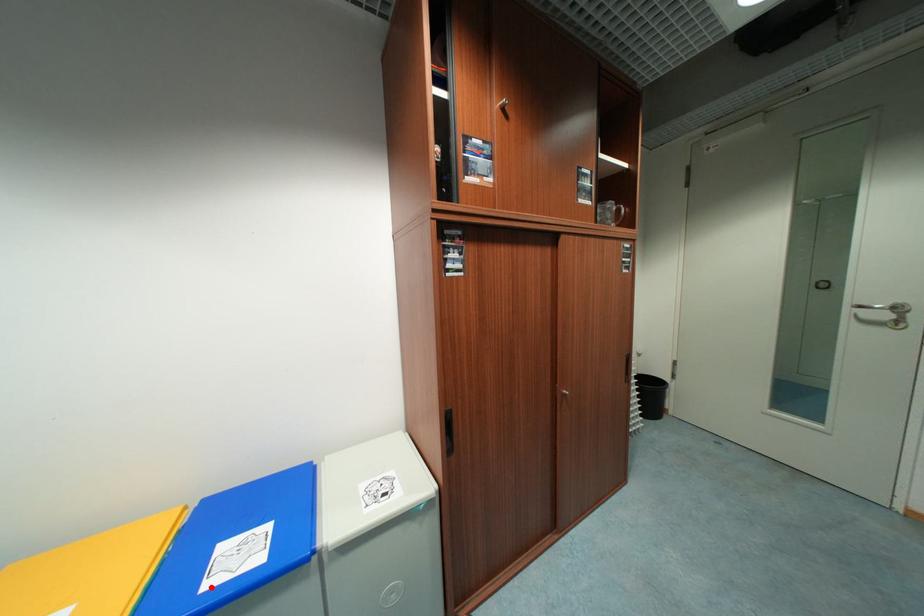
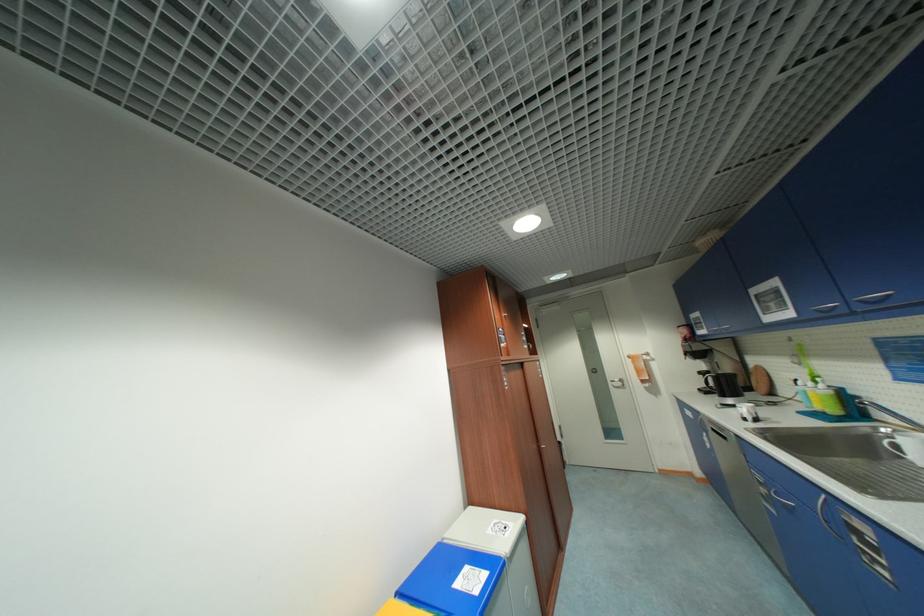
Where in the second image is the point corresponding to the highlighted location from the first image?

(482, 593)